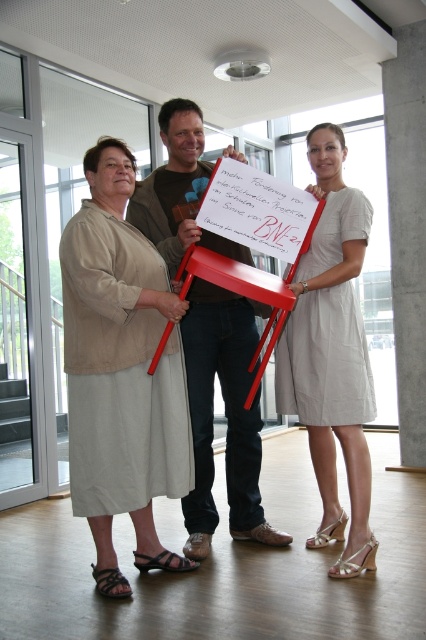
Question: Which of the following is the farthest from the observer?

Choices:
 (A) light beige dress at center
 (B) beige fabric dress at left
 (C) matte brown shirt at center

Answer: (C)

Question: Which object appears farthest from the camera in this image?

Choices:
 (A) beige fabric dress at left
 (B) light beige dress at center
 (C) matte brown shirt at center

Answer: (C)

Question: Considering the real-world distances, which object is closest to the matte brown shirt at center?

Choices:
 (A) beige fabric dress at left
 (B) light beige dress at center

Answer: (A)

Question: Can you confirm if light beige dress at center is positioned to the left of matte brown shirt at center?

Choices:
 (A) no
 (B) yes

Answer: (A)

Question: From the image, what is the correct spatial relationship of beige fabric dress at left in relation to matte brown shirt at center?

Choices:
 (A) right
 (B) left

Answer: (B)

Question: Is light beige dress at center to the right of matte brown shirt at center from the viewer's perspective?

Choices:
 (A) yes
 (B) no

Answer: (A)